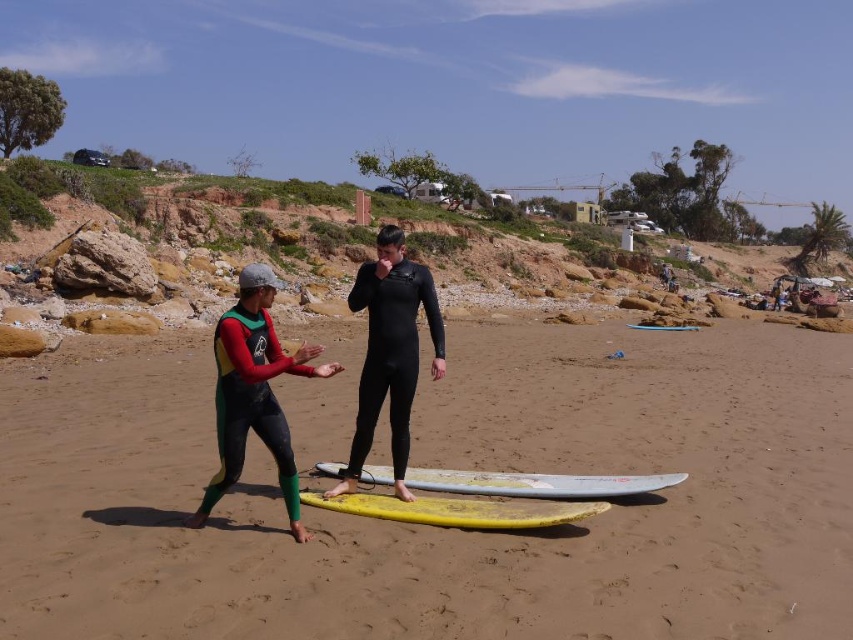
Which is in front, point (399, 400) or point (225, 374)?

Point (225, 374)

This screenshot has width=853, height=640. I want to click on neon green neoprene wetsuit at center, so click(254, 394).

This screenshot has height=640, width=853. What are the coordinates of `neon green neoprene wetsuit at center` in the screenshot? It's located at (254, 394).

Does yellow matte surfboard at center lie in front of light blue smooth surfboard at center?

Yes, yellow matte surfboard at center is in front of light blue smooth surfboard at center.

Is the position of yellow matte surfboard at center more distant than that of light blue smooth surfboard at center?

No, it is not.

Is point (537, 492) in front of point (695, 330)?

Yes, point (537, 492) is in front of point (695, 330).

What are the coordinates of `yellow matte surfboard at center` in the screenshot? It's located at (537, 483).

In the scene shown: Is smooth sand at center closer to camera compared to black matte wetsuit at center?

Yes, smooth sand at center is in front of black matte wetsuit at center.

Which is behind, point (537, 368) or point (413, 374)?

The point (537, 368) is behind.

Identify the location of smooth sand at center. This screenshot has height=640, width=853. (445, 465).